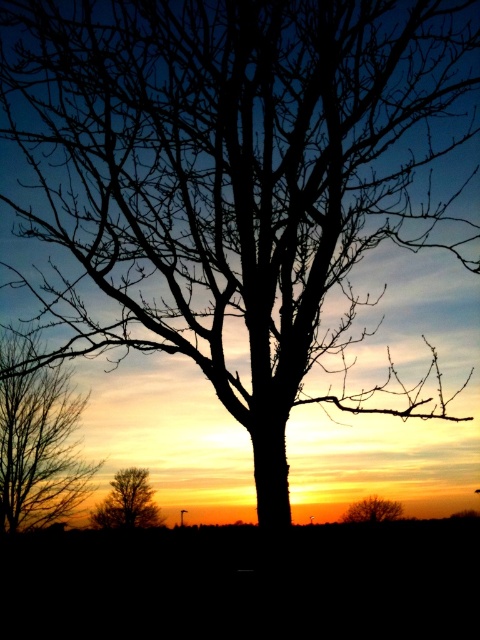
Between silhouette bare tree at left and brown textured tree at lower left, which one has less height?

brown textured tree at lower left is shorter.

Is silhouette bare tree at left positioned at the back of brown textured tree at lower left?

No, it is in front of brown textured tree at lower left.

Between point (48, 456) and point (137, 499), which one is positioned behind?

Point (48, 456)

Image resolution: width=480 pixels, height=640 pixels. Identify the location of silhouette bare tree at left. (37, 442).

Is brown textured tree at lower left further to camera compared to brown textured tree at lower right?

Yes.

What are the coordinates of `brown textured tree at lower left` in the screenshot? It's located at (128, 502).

You are a GUI agent. You are given a task and a screenshot of the screen. Output one action in this format:
    pyautogui.click(x=<x>, y=<y>)
    Task: Click on the brown textured tree at lower left
    This screenshot has width=480, height=640.
    Given the screenshot: What is the action you would take?
    pyautogui.click(x=128, y=502)

Which is above, silhouette bare tree at left or brown textured tree at lower right?

silhouette bare tree at left is higher up.

What do you see at coordinates (37, 442) in the screenshot?
I see `silhouette bare tree at left` at bounding box center [37, 442].

The height and width of the screenshot is (640, 480). I want to click on silhouette bare tree at left, so click(37, 442).